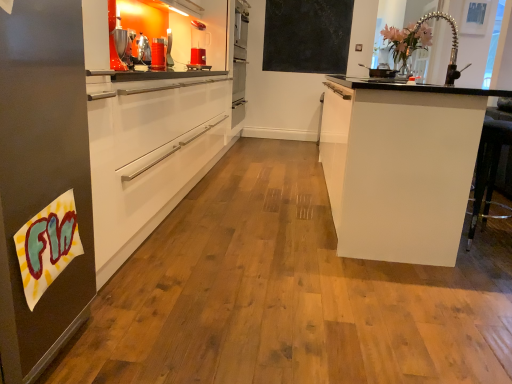
Question: Considering the relative sizes of metallic silver coffee machine at upper left and translucent plastic pitcher at center in the image provided, is metallic silver coffee machine at upper left smaller than translucent plastic pitcher at center?

Choices:
 (A) no
 (B) yes

Answer: (B)

Question: Does metallic silver coffee machine at upper left turn towards translucent plastic pitcher at center?

Choices:
 (A) no
 (B) yes

Answer: (A)

Question: Does metallic silver coffee machine at upper left lie behind translucent plastic pitcher at center?

Choices:
 (A) yes
 (B) no

Answer: (B)

Question: Would you consider metallic silver coffee machine at upper left to be distant from translucent plastic pitcher at center?

Choices:
 (A) yes
 (B) no

Answer: (B)

Question: Can you confirm if metallic silver coffee machine at upper left is positioned to the left of translucent plastic pitcher at center?

Choices:
 (A) no
 (B) yes

Answer: (B)

Question: Considering the relative sizes of metallic silver coffee machine at upper left and translucent plastic pitcher at center in the image provided, is metallic silver coffee machine at upper left wider than translucent plastic pitcher at center?

Choices:
 (A) no
 (B) yes

Answer: (A)

Question: Is white glossy cabinet at right bigger than translucent plastic pitcher at center?

Choices:
 (A) no
 (B) yes

Answer: (B)

Question: Can you see white glossy cabinet at right touching translucent plastic pitcher at center?

Choices:
 (A) yes
 (B) no

Answer: (B)

Question: Would you consider white glossy cabinet at right to be distant from translucent plastic pitcher at center?

Choices:
 (A) no
 (B) yes

Answer: (B)

Question: From a real-world perspective, is white glossy cabinet at right over translucent plastic pitcher at center?

Choices:
 (A) yes
 (B) no

Answer: (B)

Question: Is the depth of white glossy cabinet at right less than that of translucent plastic pitcher at center?

Choices:
 (A) no
 (B) yes

Answer: (B)

Question: From the image's perspective, is white glossy cabinet at right on top of translucent plastic pitcher at center?

Choices:
 (A) no
 (B) yes

Answer: (A)

Question: Is there a large distance between metallic silver coffee machine at upper left and white glossy cabinet at right?

Choices:
 (A) yes
 (B) no

Answer: (A)